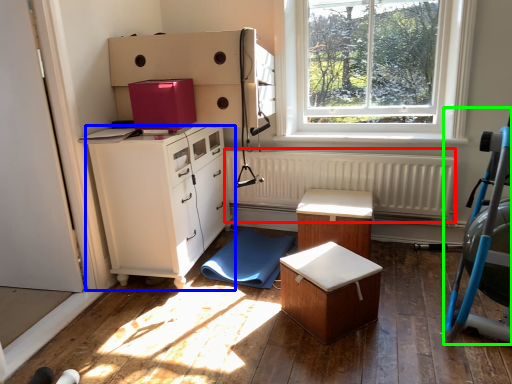
Question: Which object is positioned farthest from radiator (highlighted by a red box)? Select from chest of drawers (highlighted by a blue box) and baby carriage (highlighted by a green box).

Choices:
 (A) chest of drawers
 (B) baby carriage

Answer: (B)